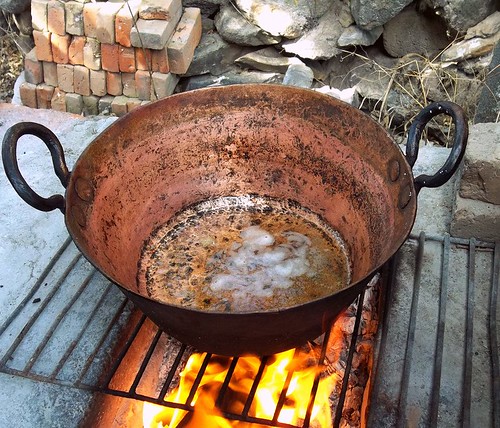
Where is `handle`? handle is located at coordinates (454, 166), (23, 191).